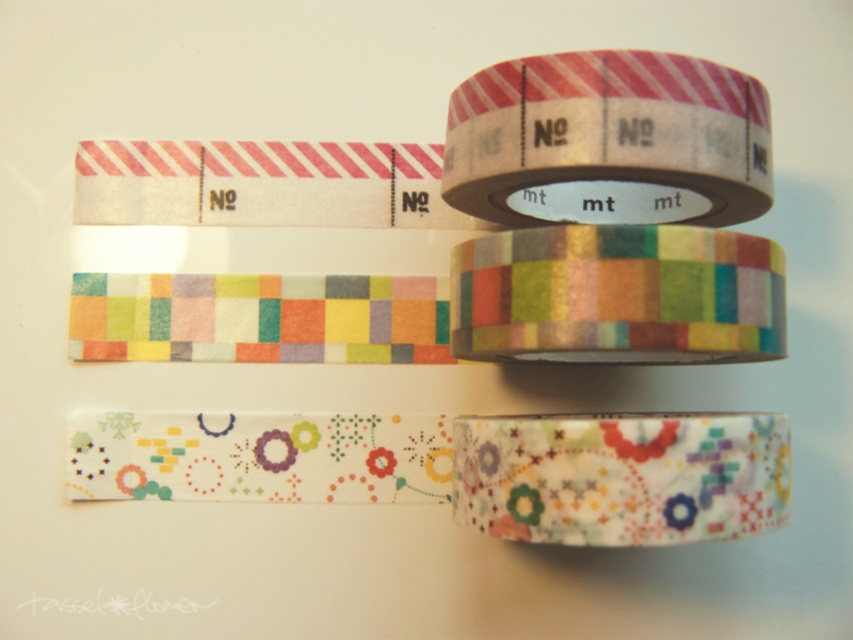
Question: Considering the relative positions of striped paper tape at upper right and multicolored glossy washi tape at center in the image provided, where is striped paper tape at upper right located with respect to multicolored glossy washi tape at center?

Choices:
 (A) below
 (B) above

Answer: (B)

Question: Among these points, which one is farthest from the camera?

Choices:
 (A) (451, 499)
 (B) (776, 259)
 (C) (639, 106)

Answer: (A)

Question: Is multicolored glossy washi tape at center positioned in front of floral-patterned paper tape at center?

Choices:
 (A) no
 (B) yes

Answer: (A)

Question: Does striped paper tape at upper right appear on the left side of floral-patterned paper tape at center?

Choices:
 (A) yes
 (B) no

Answer: (A)

Question: Among these points, which one is nearest to the camera?

Choices:
 (A) (759, 352)
 (B) (646, 465)
 (C) (740, 72)

Answer: (B)

Question: Among these objects, which one is farthest from the camera?

Choices:
 (A) striped paper tape at upper right
 (B) floral-patterned paper tape at center
 (C) multicolored glossy washi tape at center

Answer: (A)